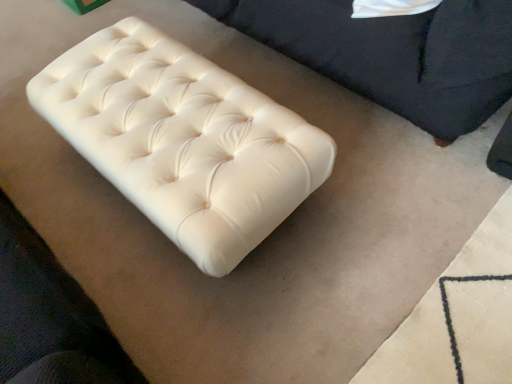
Question: In terms of height, does white leather ottoman at center, marked as the 1th furniture in a left-to-right arrangement, look taller or shorter compared to white leather ottoman at upper right, the 2th furniture from the left?

Choices:
 (A) short
 (B) tall

Answer: (A)

Question: Is white leather ottoman at center, which appears as the 2th furniture when viewed from the right, situated inside white leather ottoman at upper right, the 2th furniture from the left, or outside?

Choices:
 (A) inside
 (B) outside

Answer: (B)

Question: Is point (160, 218) positioned closer to the camera than point (285, 13)?

Choices:
 (A) farther
 (B) closer

Answer: (B)

Question: From the image's perspective, is white leather ottoman at upper right, which is the first furniture in right-to-left order, above or below white leather ottoman at center, marked as the 1th furniture in a left-to-right arrangement?

Choices:
 (A) below
 (B) above

Answer: (B)

Question: From a real-world perspective, relative to white leather ottoman at center, which appears as the 2th furniture when viewed from the right, is white leather ottoman at upper right, which is the first furniture in right-to-left order, vertically above or below?

Choices:
 (A) above
 (B) below

Answer: (A)

Question: Considering the relative positions of white leather ottoman at upper right, the 2th furniture from the left, and white leather ottoman at center, which appears as the 2th furniture when viewed from the right, in the image provided, is white leather ottoman at upper right, the 2th furniture from the left, to the left or to the right of white leather ottoman at center, which appears as the 2th furniture when viewed from the right,?

Choices:
 (A) right
 (B) left

Answer: (A)

Question: Would you say white leather ottoman at upper right, which is the first furniture in right-to-left order, is inside or outside white leather ottoman at center, which appears as the 2th furniture when viewed from the right?

Choices:
 (A) outside
 (B) inside

Answer: (A)